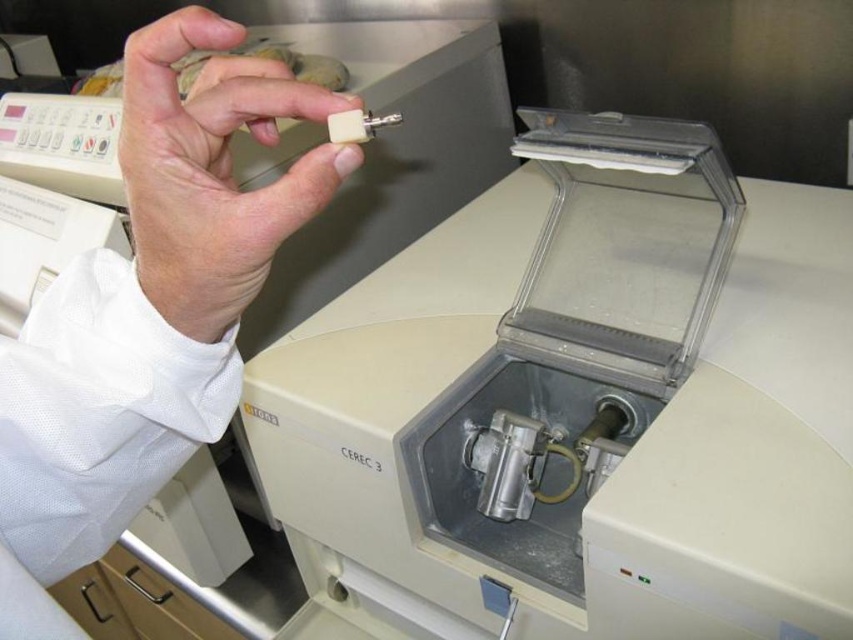
Question: Is matte white tooth at upper left below matte white tooth at upper center?

Choices:
 (A) no
 (B) yes

Answer: (B)

Question: Which point is farther from the camera taking this photo?

Choices:
 (A) (196, 248)
 (B) (45, 536)

Answer: (B)

Question: Is matte white tooth at upper left positioned behind matte white tooth at upper center?

Choices:
 (A) yes
 (B) no

Answer: (A)

Question: Is matte white tooth at upper left above matte white tooth at upper center?

Choices:
 (A) yes
 (B) no

Answer: (B)

Question: Among these objects, which one is nearest to the camera?

Choices:
 (A) matte white tooth at upper center
 (B) matte white tooth at upper left

Answer: (A)